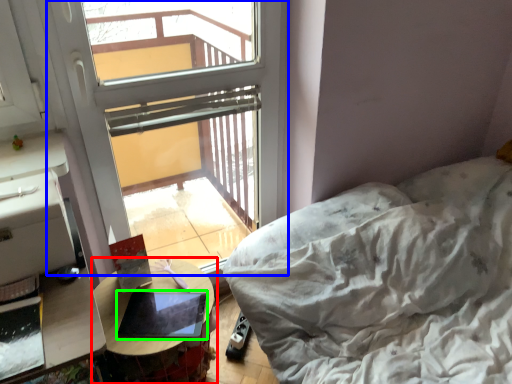
Question: Which object is positioned closest to table (highlighted by a red box)? Select from window (highlighted by a blue box) and laptop (highlighted by a green box).

Choices:
 (A) window
 (B) laptop

Answer: (B)